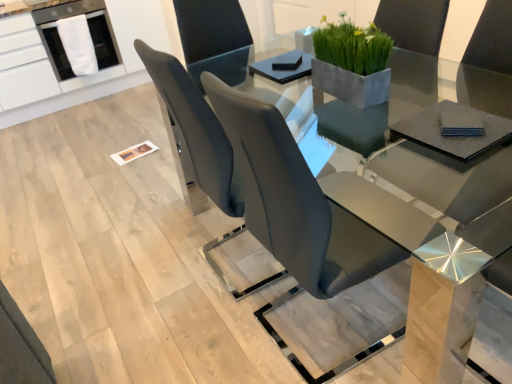
Question: In terms of size, does matte gray chair at center, positioned as the 1th chair in right-to-left order, appear bigger or smaller than white glossy dishwasher at upper left?

Choices:
 (A) small
 (B) big

Answer: (B)

Question: Looking at their shapes, would you say matte gray chair at center, which is the second chair in left-to-right order, is wider or thinner than white glossy dishwasher at upper left?

Choices:
 (A) thin
 (B) wide

Answer: (A)

Question: Which object is the farthest from the matte gray chair at center, positioned as the 1th chair in right-to-left order?

Choices:
 (A) white fabric at upper left
 (B) white glossy dishwasher at upper left
 (C) green matte concrete planter at upper center
 (D) matte gray chair at center, the 2th chair when ordered from right to left

Answer: (B)

Question: Which is farther from the white fabric at upper left?

Choices:
 (A) green matte concrete planter at upper center
 (B) matte gray chair at center, marked as the first chair in a left-to-right arrangement
 (C) matte gray chair at center, which is the second chair in left-to-right order
 (D) white glossy dishwasher at upper left

Answer: (C)